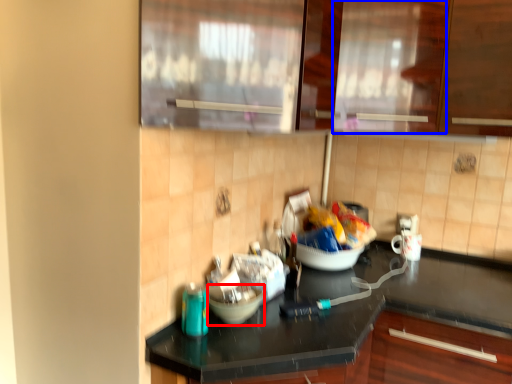
Question: Among these objects, which one is nearest to the camera, mixing bowl (highlighted by a red box) or glass door (highlighted by a blue box)?

Choices:
 (A) mixing bowl
 (B) glass door

Answer: (A)